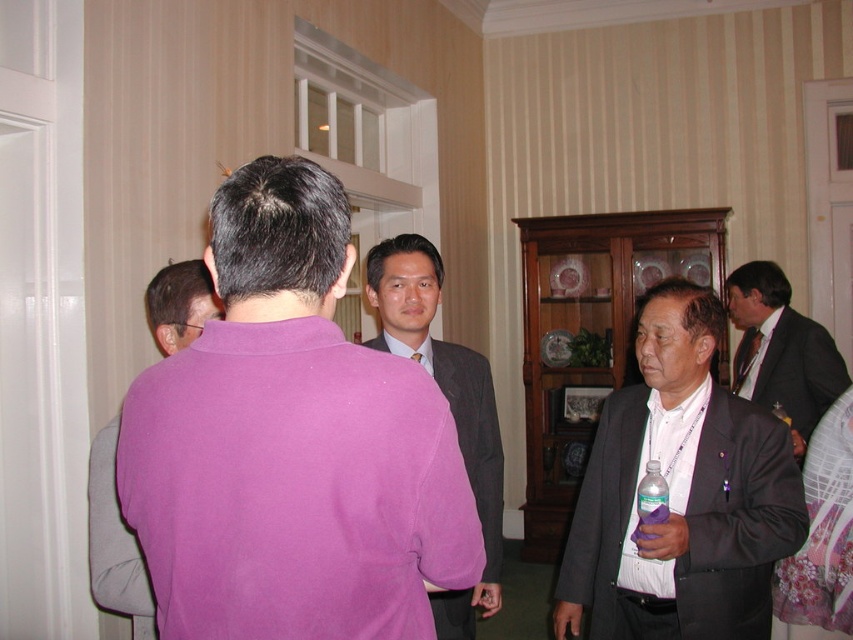
You are organizing a photo shoot and need to arrange two models in the scene. The first model is wearing a matte black suit at right, and the second is wearing a pink fabric shirt at center. According to the scene description, which model is positioned to the right of the other?

The matte black suit at right is positioned on the right side of the pink fabric shirt at center, so the model in the matte black suit at right is to the right of the one in the pink fabric shirt at center.

You are standing at the center of the room and want to move towards the matte black suit at right. According to the coordinates provided, in which direction should you move? Please specify left or right.

The coordinates of the matte black suit at right are at point 0.770 on the x and 0.798 on the y. Since the x coordinate is greater than 0.5, you should move to the right to reach it.